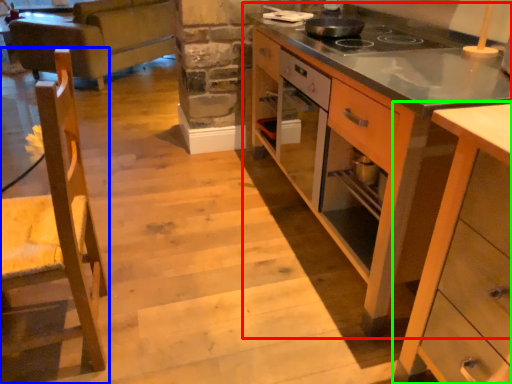
Question: Which object is the closest to the cabinetry (highlighted by a red box)? Choose among these: chair (highlighted by a blue box) or cabinetry (highlighted by a green box).

Choices:
 (A) chair
 (B) cabinetry

Answer: (B)